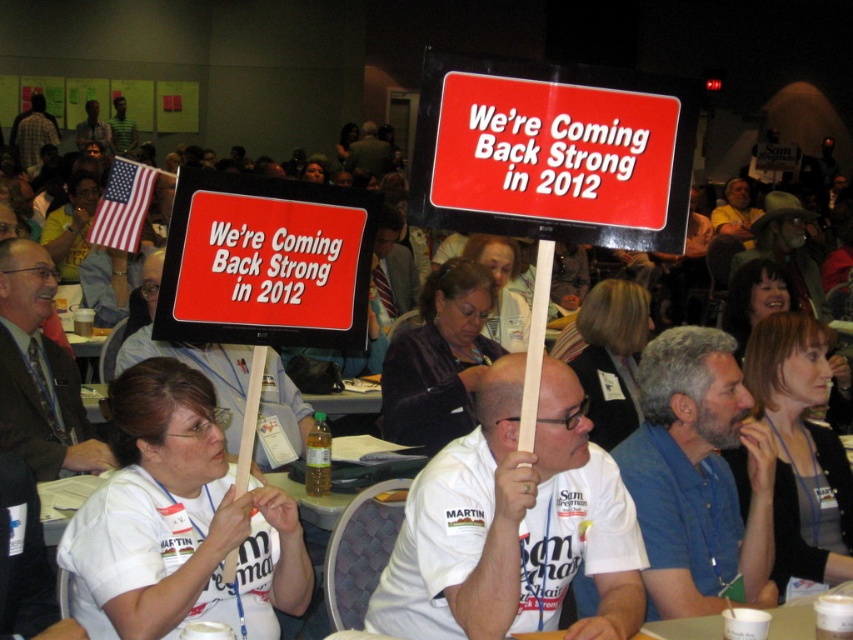
You are at the event and need to locate the blue cotton shirt at center and dark brown suit at center. From your perspective, which one is positioned lower?

The blue cotton shirt at center is located below the dark brown suit at center, so it is positioned lower.

You are standing at the entrance of the event and want to find the blue cotton shirt at center. According to the coordinates given, in which direction should you look to locate it?

The blue cotton shirt at center is located at coordinates point (697, 476), so you should look towards the lower right direction from the center of the image.

You are a photographer at the event and need to capture a group photo of the white cotton shirt at center and the blue cotton shirt at center. Which shirt should you position closer to the camera to ensure both shirts appear the same size in the photo?

The white cotton shirt at center is wider than the blue cotton shirt at center. To make both shirts appear the same size in the photo, position the narrower blue cotton shirt at center closer to the camera than the wider white cotton shirt at center.